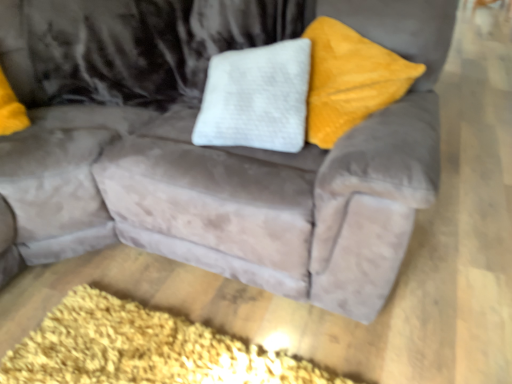
Where is `vacant area that lies to the right of yellow fluffy rug at lower left`? This screenshot has width=512, height=384. vacant area that lies to the right of yellow fluffy rug at lower left is located at coordinates (387, 316).